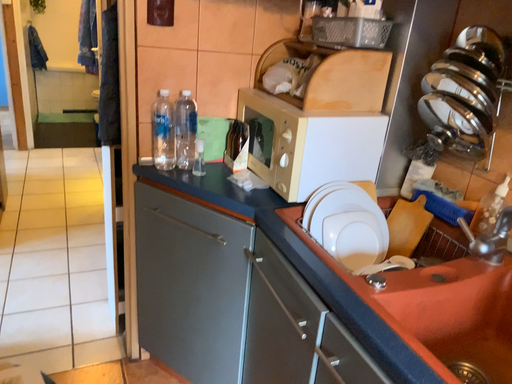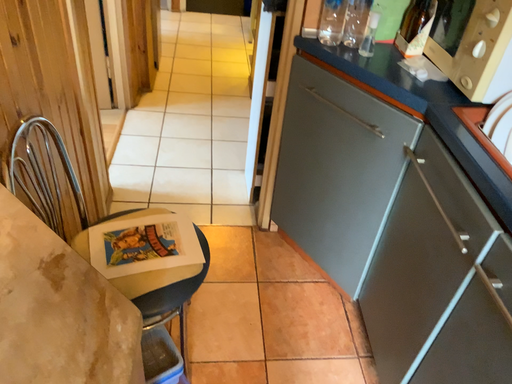
Question: How did the camera likely rotate when shooting the video?

Choices:
 (A) rotated left
 (B) rotated right

Answer: (A)